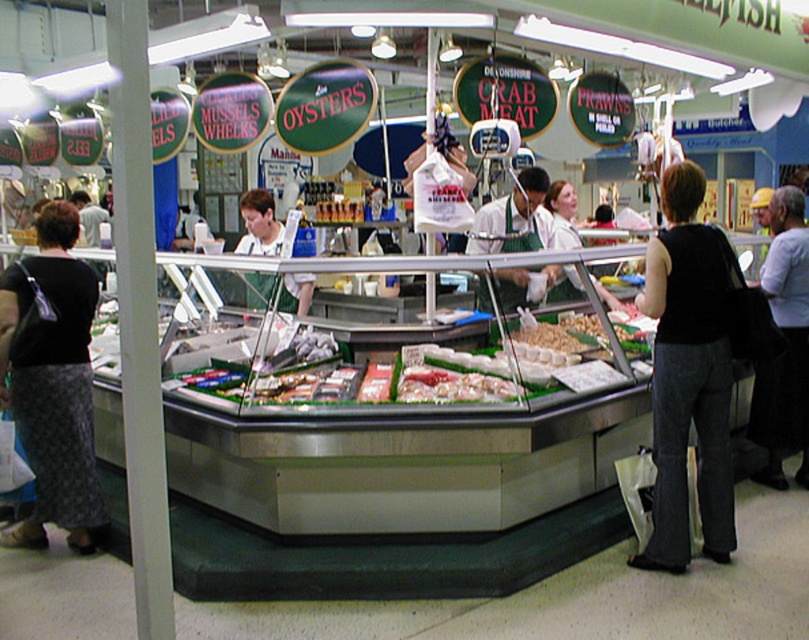
In the scene shown: Does black fabric at right have a larger size compared to green apron at center?

Yes.

Is black fabric at right smaller than green apron at center?

No, black fabric at right is not smaller than green apron at center.

Is point (760, 282) positioned before point (259, 216)?

Yes, point (760, 282) is closer to viewer.

At what (x,y) coordinates should I click in order to perform the action: click on black fabric at right. Please return your answer as a coordinate pair (x, y). Looking at the image, I should click on (784, 342).

Does black textured skirt at lower left appear over green apron at center?

Actually, black textured skirt at lower left is below green apron at center.

Measure the distance between black textured skirt at lower left and camera.

The distance of black textured skirt at lower left from camera is 3.60 meters.

Locate an element on the screen. black textured skirt at lower left is located at coordinates (53, 384).

Is the position of white apron at center less distant than that of green apron at center?

Yes, it is.

Is point (521, 282) in front of point (248, 225)?

Yes, it is.

This screenshot has width=809, height=640. Find the location of `white apron at center`. white apron at center is located at coordinates coord(515,218).